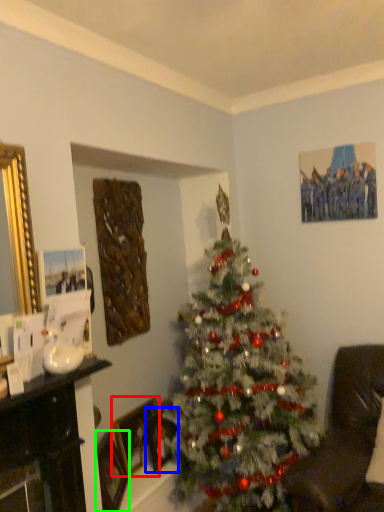
Question: Which is nearer to the picture frame (highlighted by a red box)? picture frame (highlighted by a blue box) or picture frame (highlighted by a green box).

Choices:
 (A) picture frame
 (B) picture frame

Answer: (A)